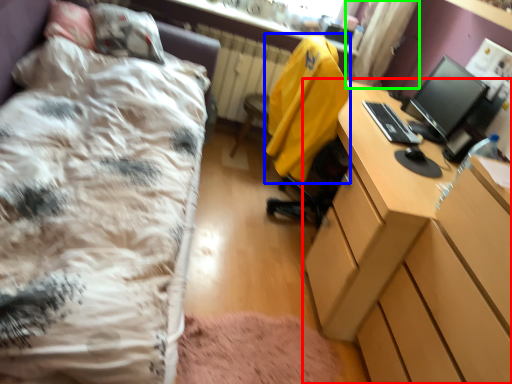
Question: Which object is the closest to the desk (highlighted by a red box)? Choose among these: jacket (highlighted by a blue box) or curtain (highlighted by a green box).

Choices:
 (A) jacket
 (B) curtain

Answer: (A)